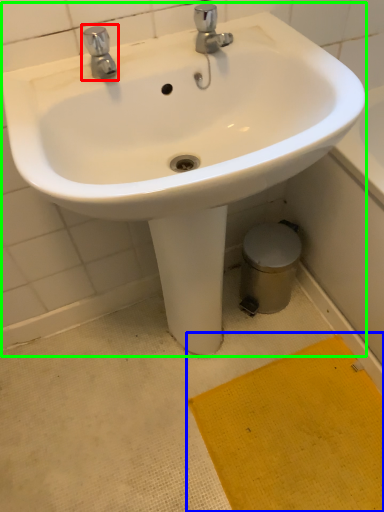
Question: Based on their relative distances, which object is nearer to tap (highlighted by a red box)? Choose from doormat (highlighted by a blue box) and sink (highlighted by a green box).

Choices:
 (A) doormat
 (B) sink

Answer: (B)